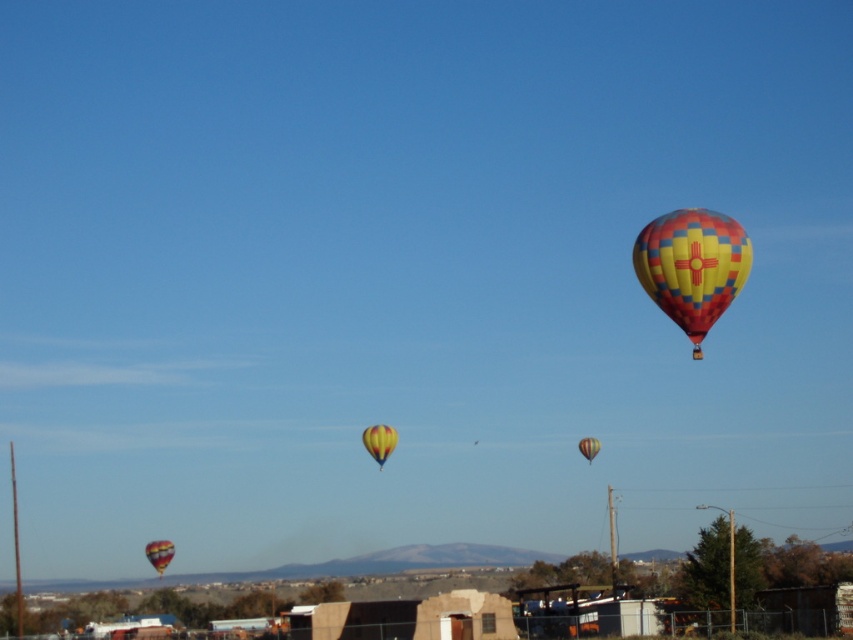
This screenshot has width=853, height=640. What do you see at coordinates (692, 266) in the screenshot?
I see `checkered fabric hot air balloon at right` at bounding box center [692, 266].

Is checkered fabric hot air balloon at right taller than matte yellow balloon at lower left?

No, checkered fabric hot air balloon at right is not taller than matte yellow balloon at lower left.

Describe the element at coordinates (692, 266) in the screenshot. I see `checkered fabric hot air balloon at right` at that location.

The height and width of the screenshot is (640, 853). Identify the location of checkered fabric hot air balloon at right. (692, 266).

Who is positioned more to the left, checkered fabric hot air balloon at right or yellow checkered balloon at upper right?

From the viewer's perspective, checkered fabric hot air balloon at right appears more on the left side.

You are a GUI agent. You are given a task and a screenshot of the screen. Output one action in this format:
    pyautogui.click(x=<x>, y=<y>)
    Task: Click on the checkered fabric hot air balloon at right
    
    Given the screenshot: What is the action you would take?
    pyautogui.click(x=692, y=266)

Is point (161, 561) farther from camera compared to point (595, 445)?

Yes, point (161, 561) is farther from viewer.

I want to click on matte yellow balloon at lower left, so click(160, 554).